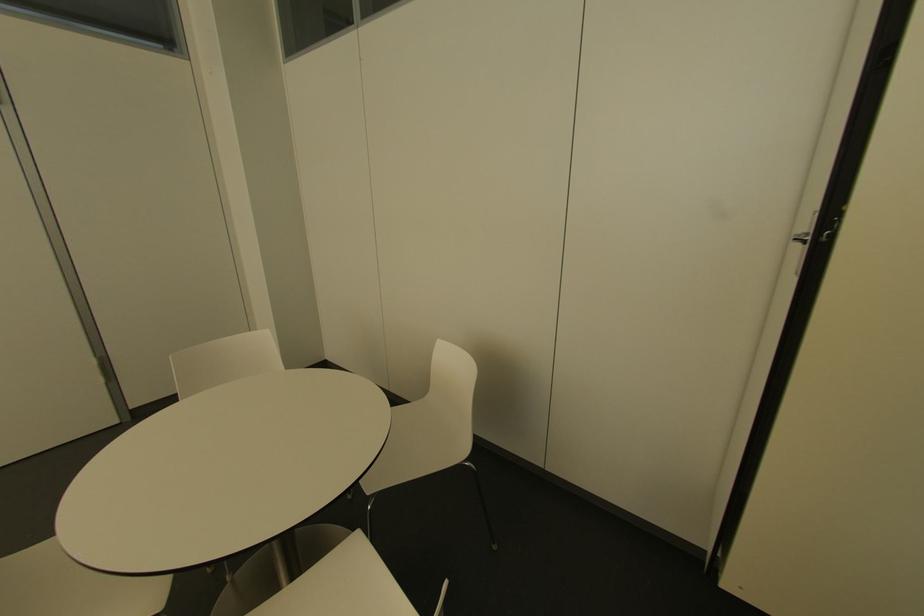
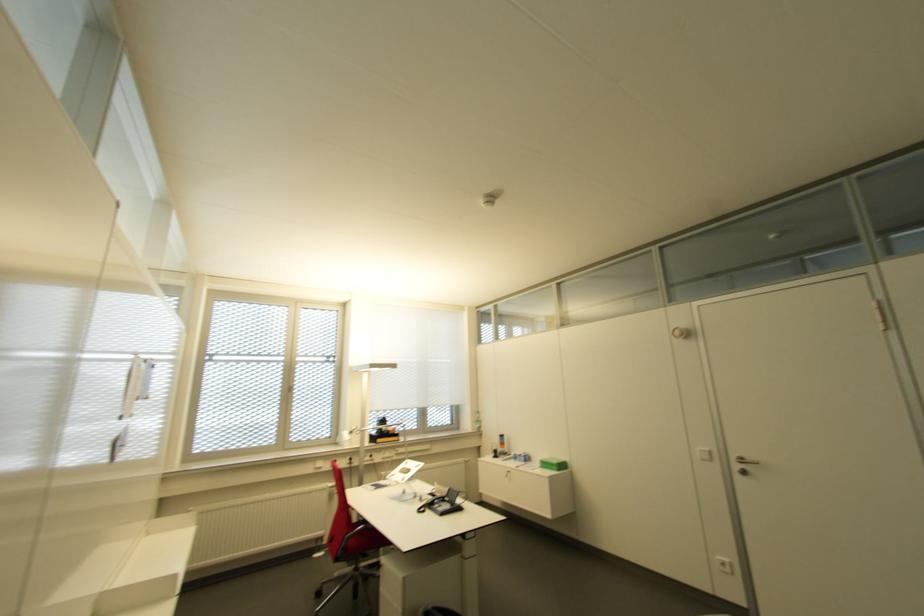
Question: The images are taken continuously from a first-person perspective. In which direction is your viewpoint rotating?

Choices:
 (A) Left
 (B) Right
 (C) Up
 (D) Down

Answer: (A)